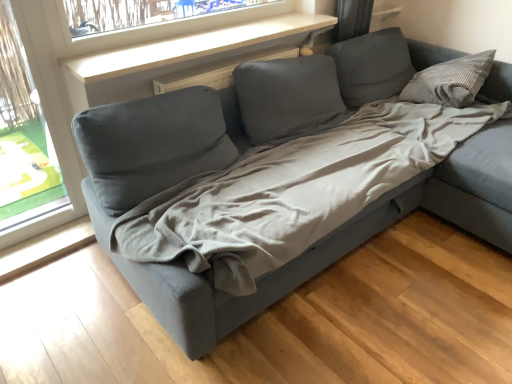
At what (x,y) coordinates should I click in order to perform the action: click on gray textured pillow at upper right. Please return your answer as a coordinate pair (x, y). The image size is (512, 384). Looking at the image, I should click on (450, 81).

Describe the element at coordinates (450, 81) in the screenshot. The image size is (512, 384). I see `gray textured pillow at upper right` at that location.

This screenshot has height=384, width=512. I want to click on gray textured pillow at upper right, so click(450, 81).